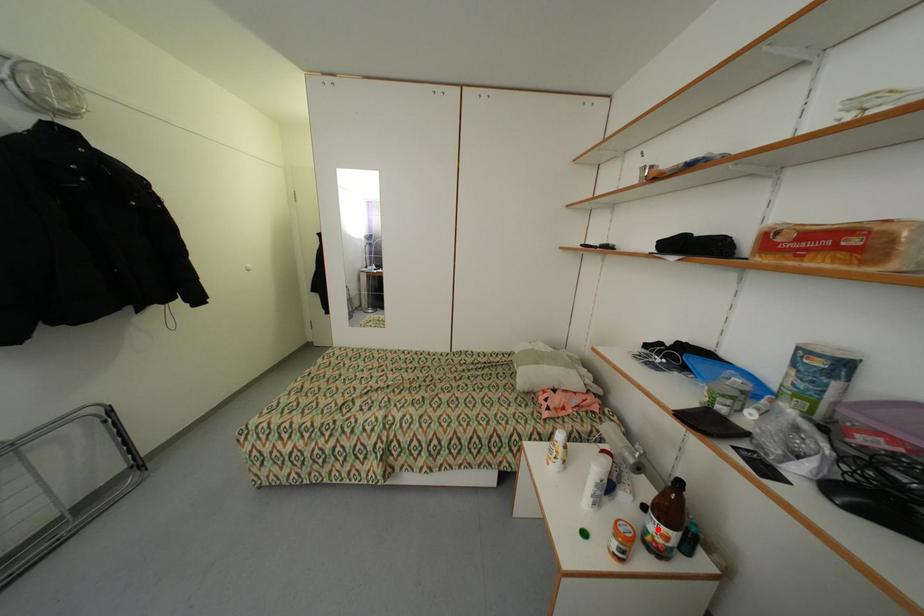
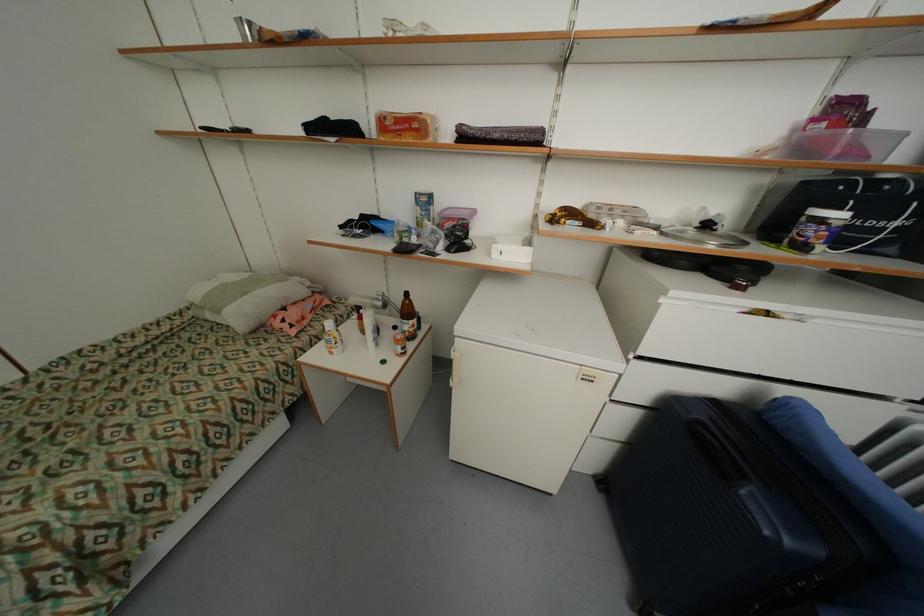
Where in the second image is the point corresponding to the highlighted location from the first image?

(411, 329)